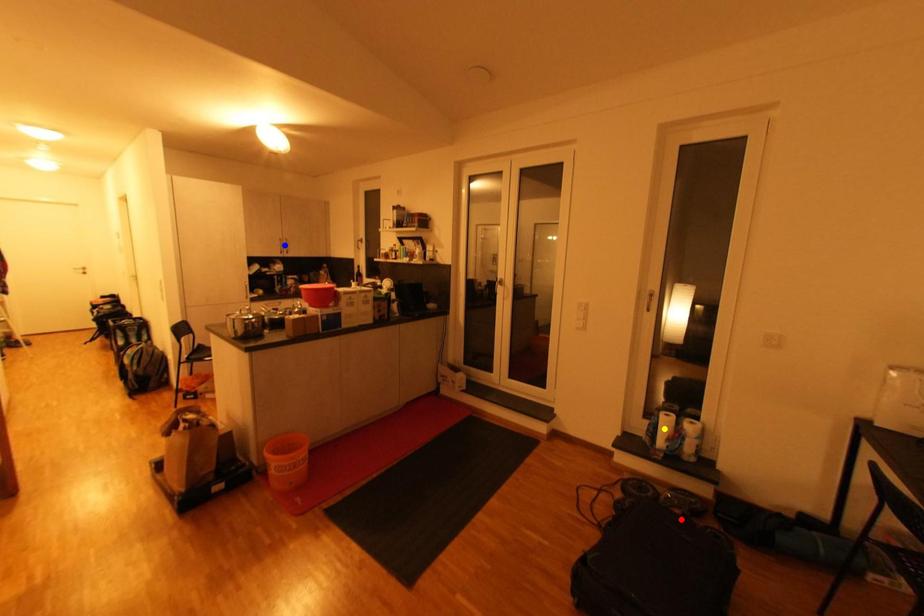
Order these from nearest to farthest:
yellow point, blue point, red point

red point
yellow point
blue point